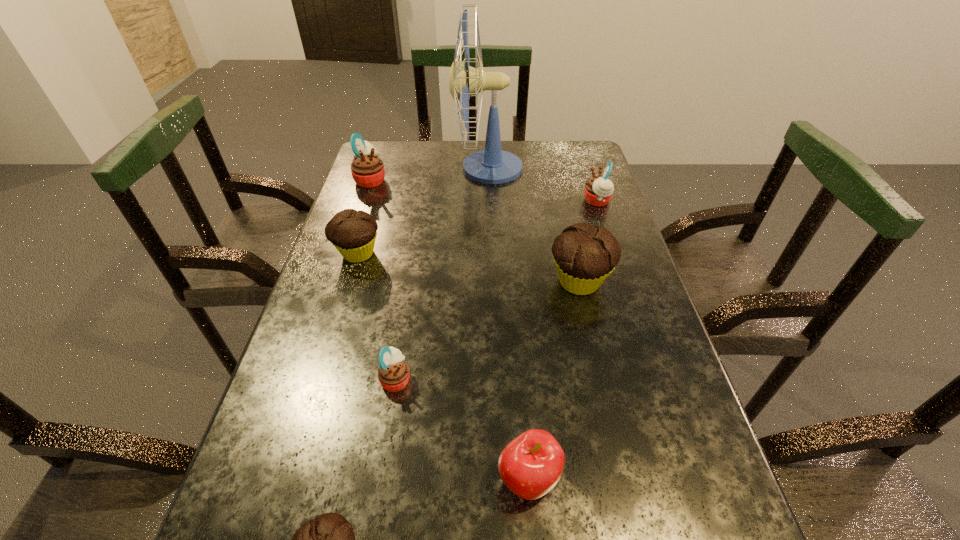
The height and width of the screenshot is (540, 960). I want to click on the sixth farthest object, so click(x=393, y=374).

Find the location of a particular element. This screenshot has width=960, height=540. the second nearest muffin is located at coordinates click(393, 374).

Locate an element on the screen. The height and width of the screenshot is (540, 960). free region located 0.080m at the front of the tallest object where the blades are visible is located at coordinates (428, 168).

The width and height of the screenshot is (960, 540). In order to click on vacant space situated at the front of the tallest object where the blades are visible in this screenshot , I will do `click(396, 168)`.

Where is `vacant space located 0.230m at the front of the tallest object where the blades are visible`? vacant space located 0.230m at the front of the tallest object where the blades are visible is located at coordinates (381, 168).

I want to click on blank space located 0.300m on the front-facing side of the farthest pink muffin, so click(x=486, y=180).

This screenshot has height=540, width=960. What are the coordinates of `free region located on the back of the biggest chocolate muffin` in the screenshot? It's located at (559, 194).

Locate an element on the screen. The image size is (960, 540). blank area located 0.270m on the front-facing side of the second farthest muffin is located at coordinates (489, 201).

I want to click on vacant space located on the front-facing side of the second farthest muffin, so click(506, 201).

At what (x,y) coordinates should I click in order to perform the action: click on free point located 0.100m on the front-facing side of the second farthest muffin. Please return your answer as a coordinate pair (x, y). Looking at the image, I should click on (548, 201).